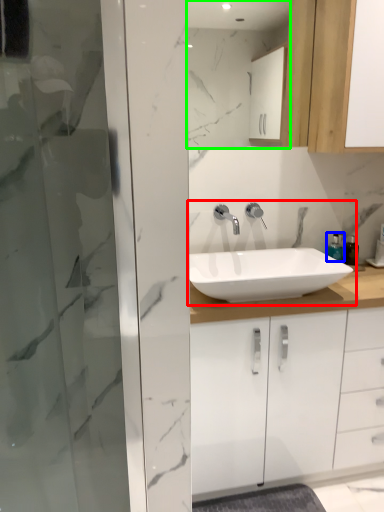
Question: Which is nearer to the sink (highlighted by a red box)? soap dispenser (highlighted by a blue box) or mirror (highlighted by a green box).

Choices:
 (A) soap dispenser
 (B) mirror

Answer: (A)